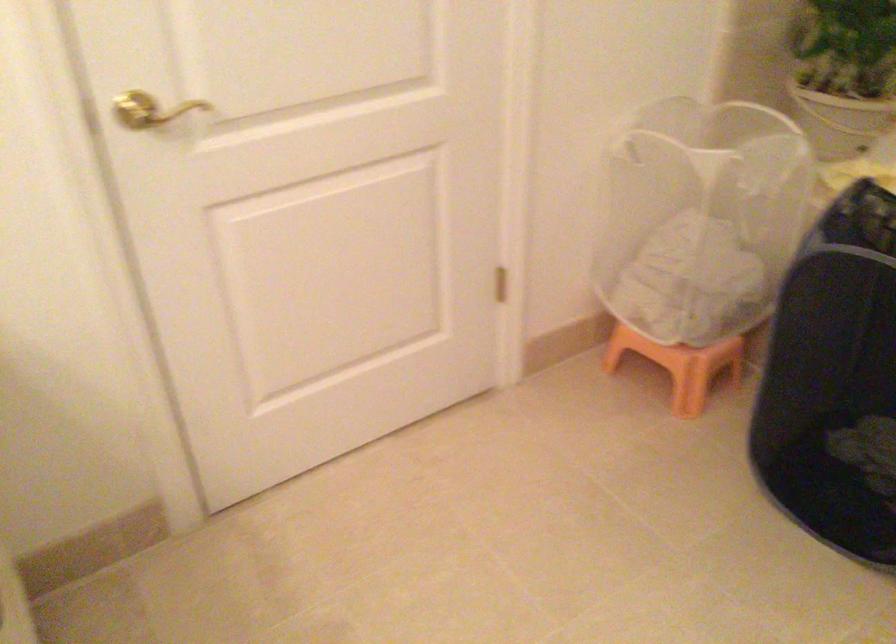
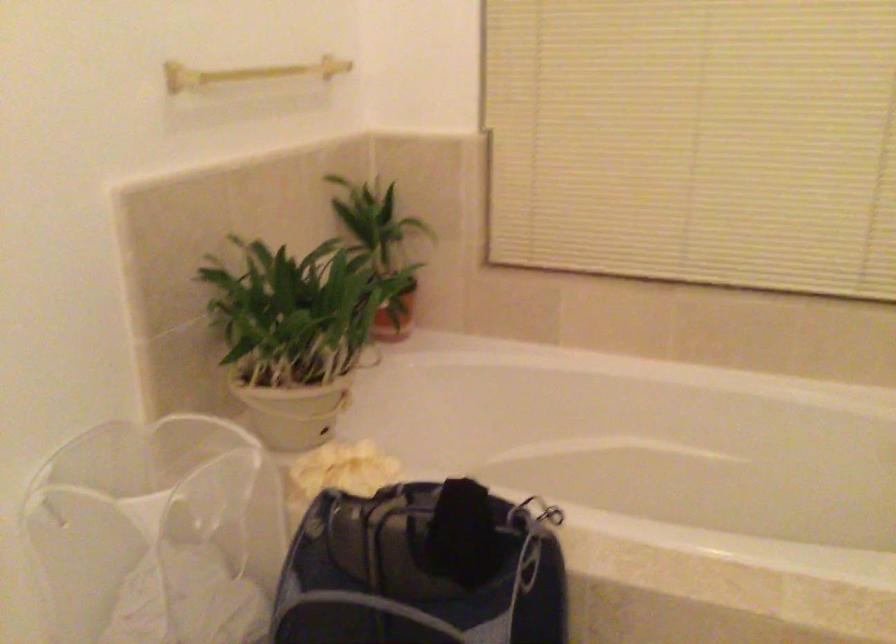
Question: The first image is from the beginning of the video and the second image is from the end. How did the camera likely rotate when shooting the video?

Choices:
 (A) Left
 (B) Right
 (C) Up
 (D) Down

Answer: (B)